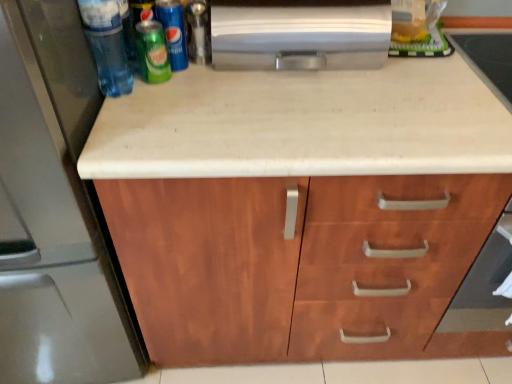
In order to face green matte pepsi can at upper left, the 2th beer in the left-to-right sequence, should I rotate leftwards or rightwards?

To align with it, rotate left about 10.572°.

You are a GUI agent. You are given a task and a screenshot of the screen. Output one action in this format:
    pyautogui.click(x=<x>, y=<y>)
    Task: Click on the satin metallic refrigerator at left
    The height and width of the screenshot is (384, 512).
    Given the screenshot: What is the action you would take?
    pyautogui.click(x=53, y=211)

This screenshot has width=512, height=384. I want to click on wooden cabinet at center, so click(x=302, y=265).

Describe the element at coordinates (302, 265) in the screenshot. I see `wooden cabinet at center` at that location.

This screenshot has width=512, height=384. Find the location of `green matte pepsi can at upper left, the 2th beer in the left-to-right sequence`. green matte pepsi can at upper left, the 2th beer in the left-to-right sequence is located at coordinates (173, 32).

Is wooden cabinet at center smaller than green matte soda can at upper left, acting as the first beer starting from the left?

No.

Is wooden cabinet at center oriented away from green matte soda can at upper left, acting as the first beer starting from the left?

No.

Can you confirm if wooden cabinet at center is shorter than green matte soda can at upper left, placed as the 2th beer when sorted from right to left?

No.

Which is in front, point (140, 36) or point (120, 95)?

Positioned in front is point (140, 36).

Looking at this image, is green matte soda can at upper left, placed as the 2th beer when sorted from right to left, not near translucent plastic bottle at upper left?

green matte soda can at upper left, placed as the 2th beer when sorted from right to left, is near translucent plastic bottle at upper left, not far away.

How far apart are green matte soda can at upper left, acting as the first beer starting from the left, and translucent plastic bottle at upper left?

green matte soda can at upper left, acting as the first beer starting from the left, and translucent plastic bottle at upper left are 3.96 inches apart.

Which of these two, green matte soda can at upper left, placed as the 2th beer when sorted from right to left, or translucent plastic bottle at upper left, stands shorter?

green matte soda can at upper left, placed as the 2th beer when sorted from right to left, is shorter.

Can we say green matte soda can at upper left, placed as the 2th beer when sorted from right to left, lies outside green matte pepsi can at upper left, the 2th beer in the left-to-right sequence?

That's correct, green matte soda can at upper left, placed as the 2th beer when sorted from right to left, is outside of green matte pepsi can at upper left, the 2th beer in the left-to-right sequence.

Considering the points (168, 78) and (178, 7), which point is in front, point (168, 78) or point (178, 7)?

The point (168, 78) is closer to the camera.

How different are the orientations of green matte soda can at upper left, placed as the 2th beer when sorted from right to left, and green matte pepsi can at upper left, acting as the 1th beer starting from the right, in degrees?

0.0058 degrees separate the facing orientations of green matte soda can at upper left, placed as the 2th beer when sorted from right to left, and green matte pepsi can at upper left, acting as the 1th beer starting from the right.

Could you tell me if green matte soda can at upper left, placed as the 2th beer when sorted from right to left, is turned towards green matte pepsi can at upper left, the 2th beer in the left-to-right sequence?

No, green matte soda can at upper left, placed as the 2th beer when sorted from right to left, is not oriented towards green matte pepsi can at upper left, the 2th beer in the left-to-right sequence.

Would you consider silver metallic paper towel holder at upper center to be distant from satin metallic refrigerator at left?

silver metallic paper towel holder at upper center is actually quite close to satin metallic refrigerator at left.

Is silver metallic paper towel holder at upper center looking in the opposite direction of satin metallic refrigerator at left?

That's not correct — silver metallic paper towel holder at upper center is not looking away from satin metallic refrigerator at left.

In terms of height, does silver metallic paper towel holder at upper center look taller or shorter compared to satin metallic refrigerator at left?

silver metallic paper towel holder at upper center is shorter than satin metallic refrigerator at left.

Which object is positioned more to the left, silver metallic paper towel holder at upper center or satin metallic refrigerator at left?

satin metallic refrigerator at left is more to the left.

From a real-world perspective, who is located lower, wooden cabinet at center or silver metallic paper towel holder at upper center?

From a 3D spatial view, wooden cabinet at center is below.

Does point (342, 282) come farther from viewer compared to point (304, 67)?

Yes.

You are a GUI agent. You are given a task and a screenshot of the screen. Output one action in this format:
    pyautogui.click(x=<x>, y=<y>)
    Task: Click on the cabinetry in front of the silver metallic paper towel holder at upper center
    
    Given the screenshot: What is the action you would take?
    pos(302,265)

Would you say green matte soda can at upper left, placed as the 2th beer when sorted from right to left, is part of translucent plastic bottle at upper left's contents?

No, green matte soda can at upper left, placed as the 2th beer when sorted from right to left, is not a part of translucent plastic bottle at upper left.

Considering the relative sizes of translucent plastic bottle at upper left and green matte soda can at upper left, acting as the first beer starting from the left, in the image provided, is translucent plastic bottle at upper left thinner than green matte soda can at upper left, acting as the first beer starting from the left,?

In fact, translucent plastic bottle at upper left might be wider than green matte soda can at upper left, acting as the first beer starting from the left.

Looking at this image, which object is further away from the camera taking this photo, translucent plastic bottle at upper left or green matte soda can at upper left, placed as the 2th beer when sorted from right to left?

green matte soda can at upper left, placed as the 2th beer when sorted from right to left, is further away from the camera.

How distant is translucent plastic bottle at upper left from green matte soda can at upper left, placed as the 2th beer when sorted from right to left?

translucent plastic bottle at upper left and green matte soda can at upper left, placed as the 2th beer when sorted from right to left, are 3.96 inches apart.

Which object is positioned more to the left, silver metallic paper towel holder at upper center or wooden cabinet at center?

Positioned to the left is silver metallic paper towel holder at upper center.

How distant is silver metallic paper towel holder at upper center from wooden cabinet at center?

They are 17.64 inches apart.

In terms of size, does silver metallic paper towel holder at upper center appear bigger or smaller than wooden cabinet at center?

silver metallic paper towel holder at upper center is smaller than wooden cabinet at center.

The image size is (512, 384). In order to click on the 1st beer above the wooden cabinet at center (from the image's perspective) in this screenshot , I will do `click(152, 52)`.

The height and width of the screenshot is (384, 512). I want to click on beverage that is on the left side of green matte soda can at upper left, placed as the 2th beer when sorted from right to left, so click(x=106, y=45).

Looking at the image, which one is located further to wooden cabinet at center, green matte soda can at upper left, acting as the first beer starting from the left, or silver metallic paper towel holder at upper center?

green matte soda can at upper left, acting as the first beer starting from the left.

Which object lies nearer to the anchor point silver metallic paper towel holder at upper center, wooden cabinet at center or translucent plastic bottle at upper left?

Among the two, translucent plastic bottle at upper left is located nearer to silver metallic paper towel holder at upper center.

Based on their spatial positions, is satin metallic refrigerator at left or green matte soda can at upper left, acting as the first beer starting from the left, closer to green matte pepsi can at upper left, acting as the 1th beer starting from the right?

Based on the image, green matte soda can at upper left, acting as the first beer starting from the left, appears to be nearer to green matte pepsi can at upper left, acting as the 1th beer starting from the right.

Which object lies further to the anchor point translucent plastic bottle at upper left, silver metallic paper towel holder at upper center or satin metallic refrigerator at left?

Among the two, silver metallic paper towel holder at upper center is located further to translucent plastic bottle at upper left.

Based on their spatial positions, is silver metallic paper towel holder at upper center or satin metallic refrigerator at left closer to green matte pepsi can at upper left, acting as the 1th beer starting from the right?

Based on the image, silver metallic paper towel holder at upper center appears to be nearer to green matte pepsi can at upper left, acting as the 1th beer starting from the right.

From the image, which object appears to be farther from green matte soda can at upper left, acting as the first beer starting from the left, green matte pepsi can at upper left, acting as the 1th beer starting from the right, or wooden cabinet at center?

wooden cabinet at center.

Considering their positions, is satin metallic refrigerator at left positioned closer to silver metallic paper towel holder at upper center than translucent plastic bottle at upper left?

translucent plastic bottle at upper left lies closer to silver metallic paper towel holder at upper center than the other object.

From the picture: Estimate the real-world distances between objects in this image. Which object is further from translucent plastic bottle at upper left, green matte pepsi can at upper left, acting as the 1th beer starting from the right, or satin metallic refrigerator at left?

satin metallic refrigerator at left.

Image resolution: width=512 pixels, height=384 pixels. I want to click on beverage located between satin metallic refrigerator at left and silver metallic paper towel holder at upper center in the left-right direction, so click(106, 45).

Where is `appliance situated between green matte pepsi can at upper left, acting as the 1th beer starting from the right, and wooden cabinet at center from left to right`? appliance situated between green matte pepsi can at upper left, acting as the 1th beer starting from the right, and wooden cabinet at center from left to right is located at coordinates (298, 34).

Identify the location of beer situated between satin metallic refrigerator at left and green matte pepsi can at upper left, acting as the 1th beer starting from the right, from left to right. (152, 52).

The height and width of the screenshot is (384, 512). I want to click on beer between green matte soda can at upper left, acting as the first beer starting from the left, and silver metallic paper towel holder at upper center, in the horizontal direction, so click(x=173, y=32).